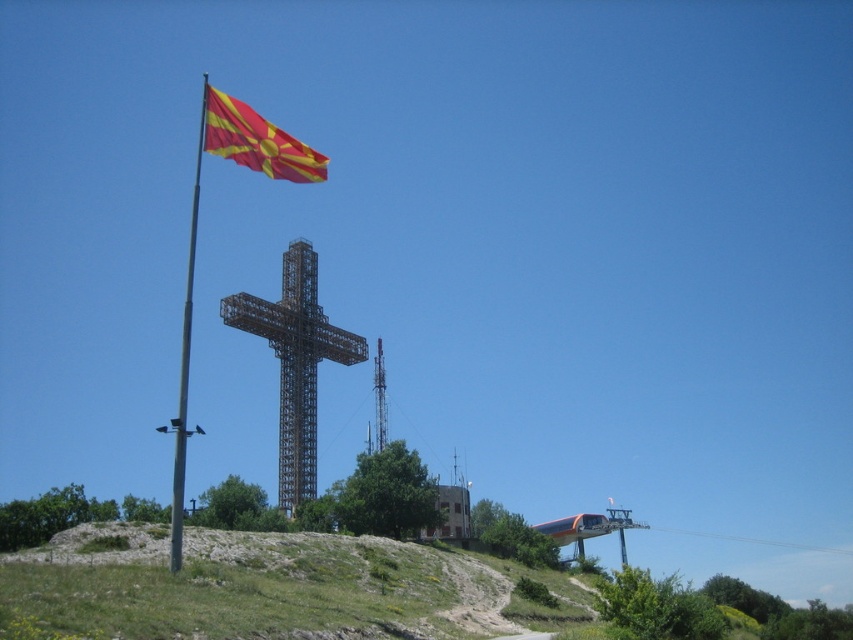
Question: Can you confirm if metallic cross at center is thinner than red fabric flag at upper left?

Choices:
 (A) yes
 (B) no

Answer: (A)

Question: Which object appears farthest from the camera in this image?

Choices:
 (A) metallic cross at center
 (B) red fabric flag at upper left

Answer: (A)

Question: Which object is closer to the camera taking this photo?

Choices:
 (A) metallic flag pole at left
 (B) red fabric flag at upper left
 (C) metallic cross at center

Answer: (A)

Question: Which of the following is the closest to the observer?

Choices:
 (A) metallic flag pole at left
 (B) metallic cross at center

Answer: (A)

Question: Can you confirm if metallic cross at center is positioned to the left of metallic flag pole at left?

Choices:
 (A) no
 (B) yes

Answer: (A)

Question: Does metallic cross at center appear on the right side of metallic flag pole at left?

Choices:
 (A) no
 (B) yes

Answer: (B)